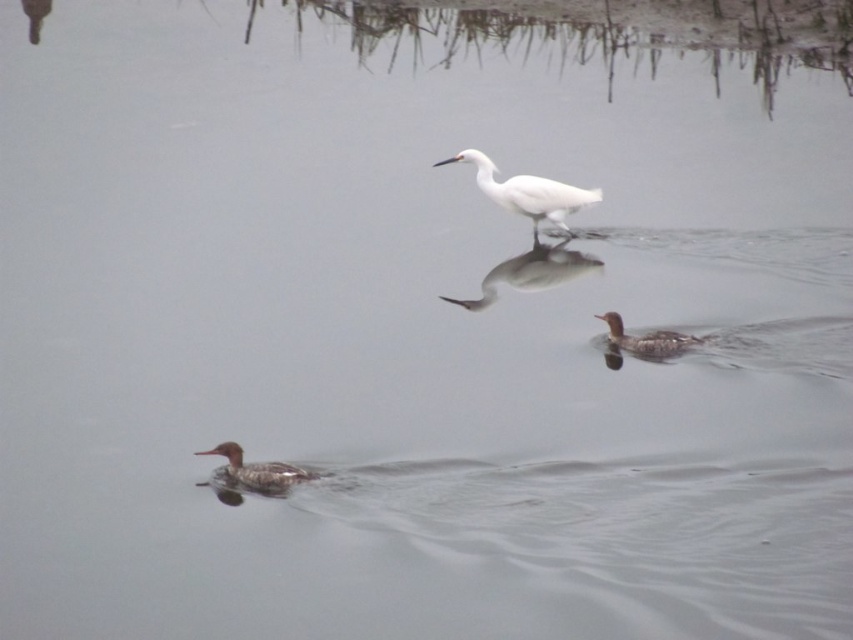
Question: Considering the relative positions of brown matte duck at lower left and brown matte duck at center-right in the image provided, where is brown matte duck at lower left located with respect to brown matte duck at center-right?

Choices:
 (A) below
 (B) above

Answer: (A)

Question: Which object is the farthest from the brown matte duck at lower left?

Choices:
 (A) brown matte duck at center-right
 (B) white matte bird at center

Answer: (B)

Question: From the image, what is the correct spatial relationship of white matte bird at center in relation to brown matte duck at center-right?

Choices:
 (A) right
 (B) left

Answer: (B)

Question: Considering the relative positions of white matte bird at center and brown matte duck at lower left in the image provided, where is white matte bird at center located with respect to brown matte duck at lower left?

Choices:
 (A) below
 (B) above

Answer: (B)

Question: Which of these objects is positioned farthest from the white matte bird at center?

Choices:
 (A) brown matte duck at lower left
 (B) brown matte duck at center-right

Answer: (A)

Question: Considering the real-world distances, which object is closest to the brown matte duck at lower left?

Choices:
 (A) white matte bird at center
 (B) brown matte duck at center-right

Answer: (B)